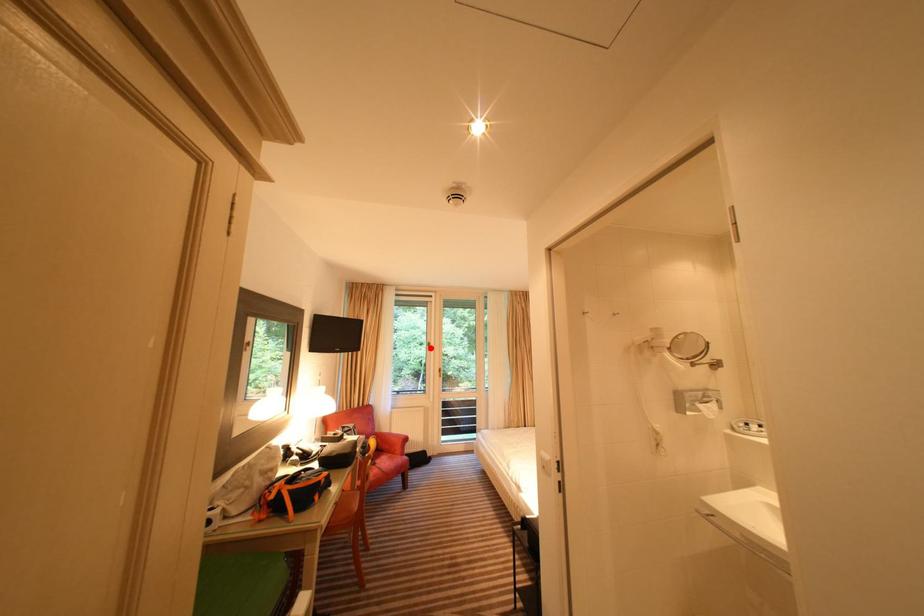
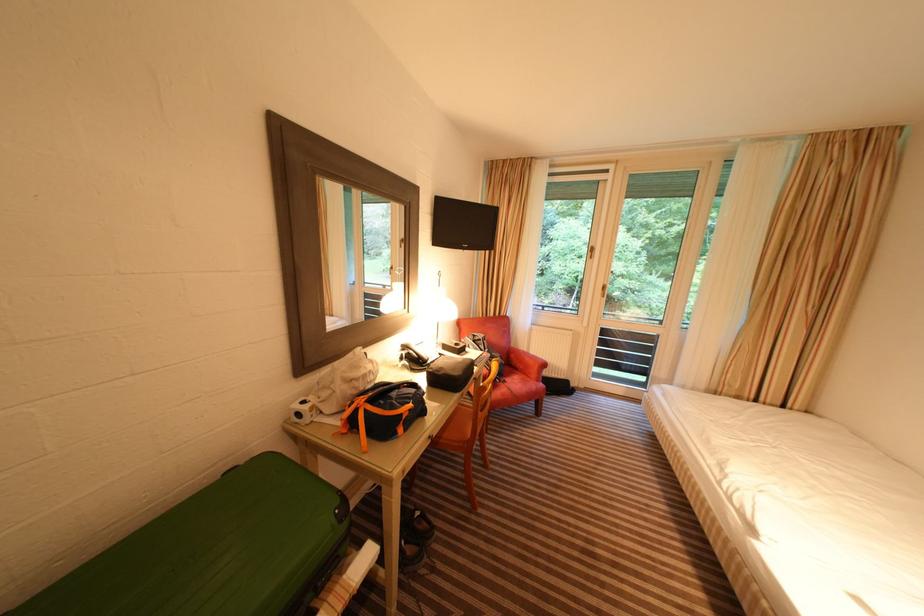
Where in the second image is the point corresponding to the highlighted location from the first image?

(590, 254)